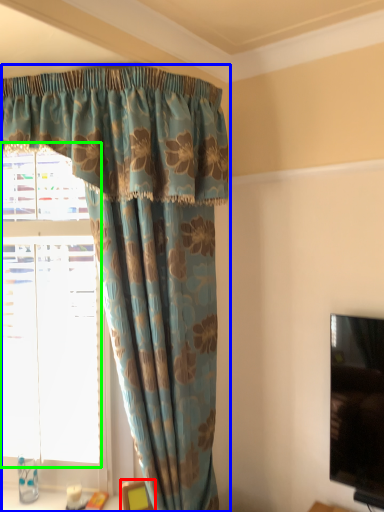
Question: Based on their relative distances, which object is nearer to furniture (highlighted by a red box)? Choose from curtain (highlighted by a blue box) and bay window (highlighted by a green box).

Choices:
 (A) curtain
 (B) bay window

Answer: (B)